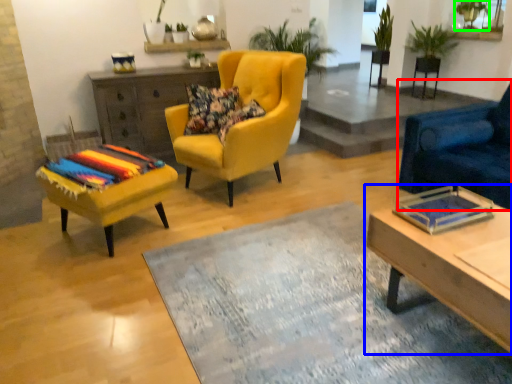
Question: Which object is the closest to the chair (highlighted by a red box)? Choose among these: coffee table (highlighted by a blue box) or plant (highlighted by a green box).

Choices:
 (A) coffee table
 (B) plant

Answer: (A)